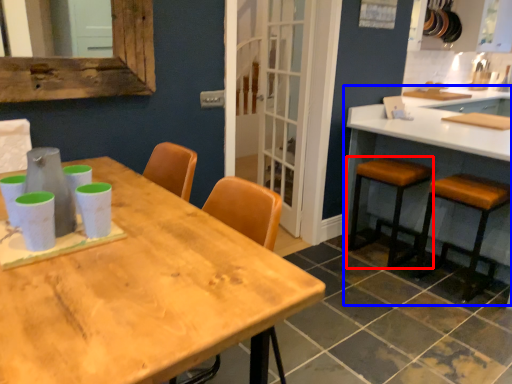
Question: Which object is closer to the camera taking this photo, stool (highlighted by a red box) or counter (highlighted by a blue box)?

Choices:
 (A) stool
 (B) counter

Answer: (B)